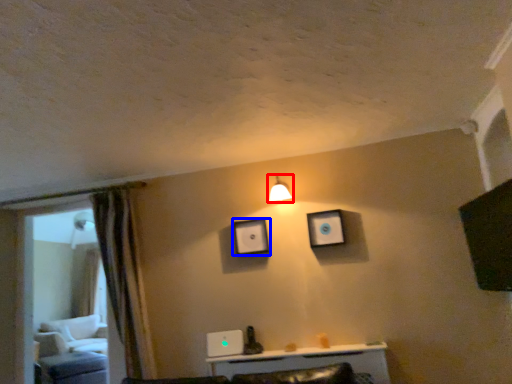
Question: Which point is further to the camera, light fixture (highlighted by a red box) or picture frame (highlighted by a blue box)?

Choices:
 (A) light fixture
 (B) picture frame

Answer: (B)